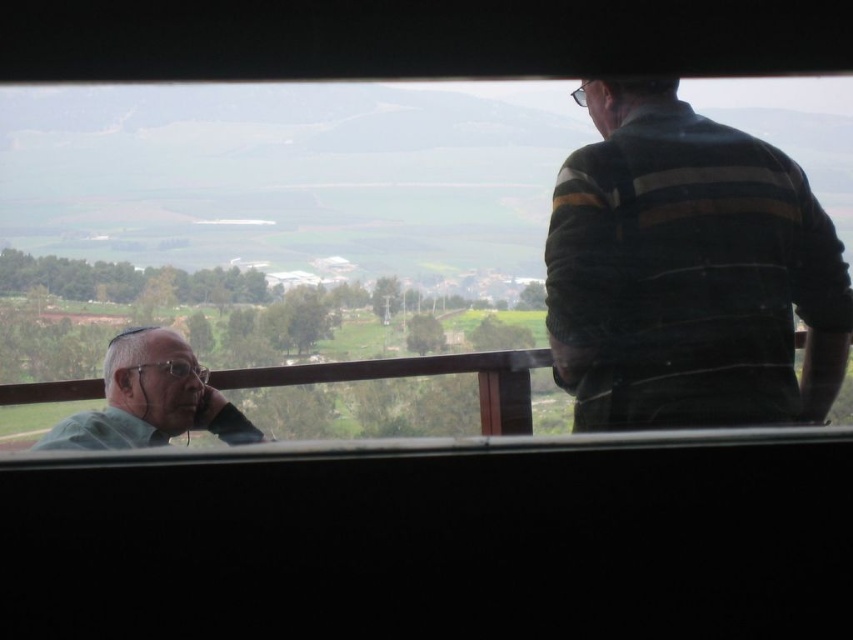
Question: Estimate the real-world distances between objects in this image. Which object is farther from the transparent glass window at center?

Choices:
 (A) striped sweater at right
 (B) green matte shirt at left

Answer: (B)

Question: Among these points, which one is farthest from the camera?

Choices:
 (A) (548, 316)
 (B) (199, 144)
 (C) (171, 394)

Answer: (A)

Question: Which point is closer to the camera?

Choices:
 (A) (611, 352)
 (B) (670, 365)

Answer: (B)

Question: Is transparent glass window at center further to the viewer compared to green matte shirt at left?

Choices:
 (A) yes
 (B) no

Answer: (B)

Question: Is transparent glass window at center further to the viewer compared to green matte shirt at left?

Choices:
 (A) yes
 (B) no

Answer: (B)

Question: Can you confirm if transparent glass window at center is bigger than green matte shirt at left?

Choices:
 (A) yes
 (B) no

Answer: (A)